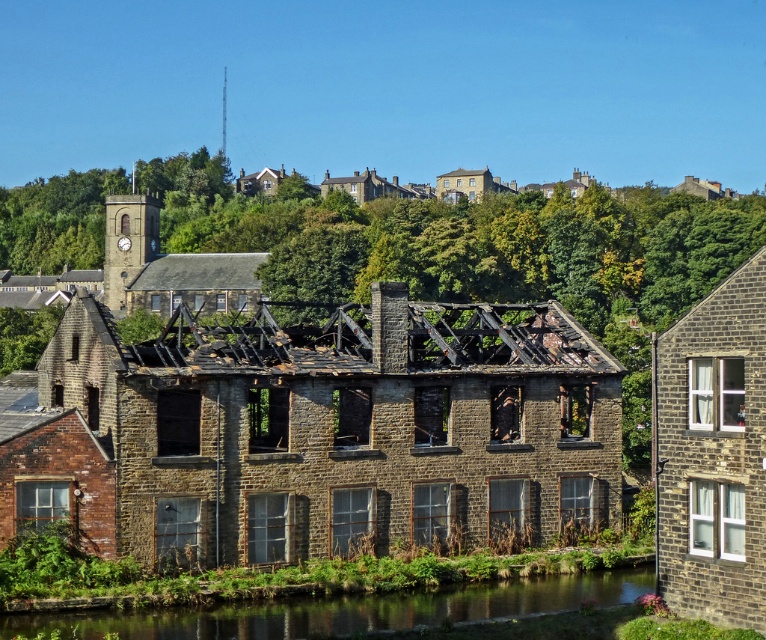
Can you confirm if brown stone building at center is smaller than green grassy river at lower center?

No.

Can you confirm if brown stone building at center is taller than green grassy river at lower center?

Yes.

Image resolution: width=766 pixels, height=640 pixels. What do you see at coordinates (339, 426) in the screenshot?
I see `brown stone building at center` at bounding box center [339, 426].

Identify the location of brown stone building at center. (339, 426).